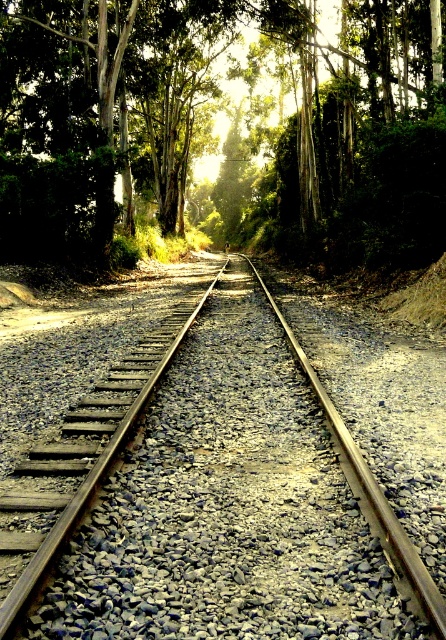
Question: Is metal train track at center below green leafy tree at center?

Choices:
 (A) no
 (B) yes

Answer: (B)

Question: Which of the following is the closest to the observer?

Choices:
 (A) metal train track at center
 (B) green leafy tree at center

Answer: (A)

Question: Which point is farther from the camera taking this photo?

Choices:
 (A) (213, 624)
 (B) (168, 154)

Answer: (B)

Question: Is metal train track at center closer to camera compared to green leafy tree at center?

Choices:
 (A) yes
 (B) no

Answer: (A)

Question: From the image, what is the correct spatial relationship of metal train track at center in relation to green leafy tree at center?

Choices:
 (A) above
 (B) below

Answer: (B)